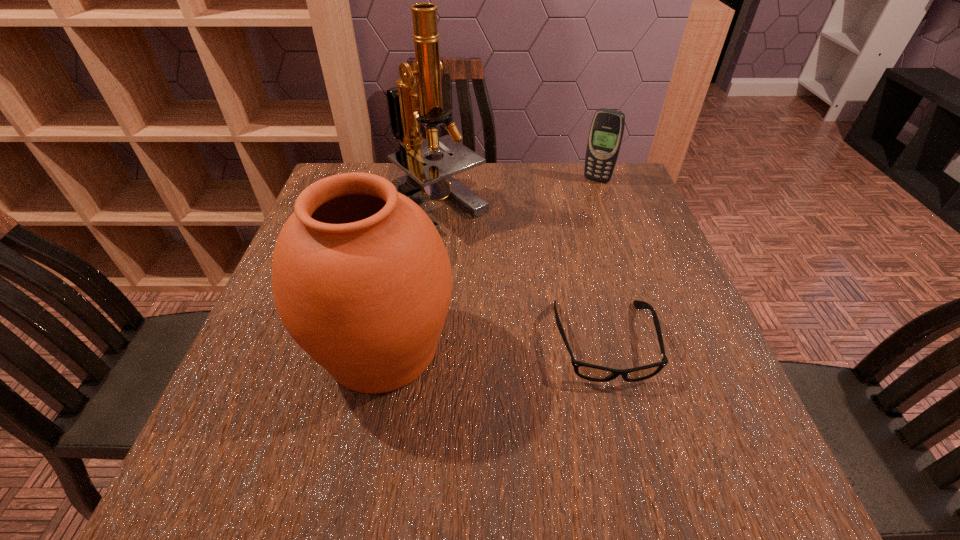
You are a GUI agent. You are given a task and a screenshot of the screen. Output one action in this format:
    pyautogui.click(x=<x>, y=<y>)
    Task: Click on the vacant space that's between the shortest object and the cellular telephone
    The image size is (960, 540).
    Given the screenshot: What is the action you would take?
    pyautogui.click(x=600, y=261)

The width and height of the screenshot is (960, 540). I want to click on empty location between the second shortest object and the spectacles, so click(x=600, y=261).

This screenshot has height=540, width=960. I want to click on unoccupied position between the urn and the shortest object, so click(x=493, y=345).

Locate which object ranks in proximity to the microscope. Please provide its 2D coordinates. Your answer should be formatted as a tuple, i.e. [(x, y)], where the tuple contains the x and y coordinates of a point satisfying the conditions above.

[(362, 281)]

Image resolution: width=960 pixels, height=540 pixels. Find the location of `object that is the third closest one to the microscope`. object that is the third closest one to the microscope is located at coordinates (606, 132).

This screenshot has width=960, height=540. I want to click on free space that satisfies the following two spatial constraints: 1. on the back side of the second tallest object; 2. on the right side of the tallest object, so click(410, 206).